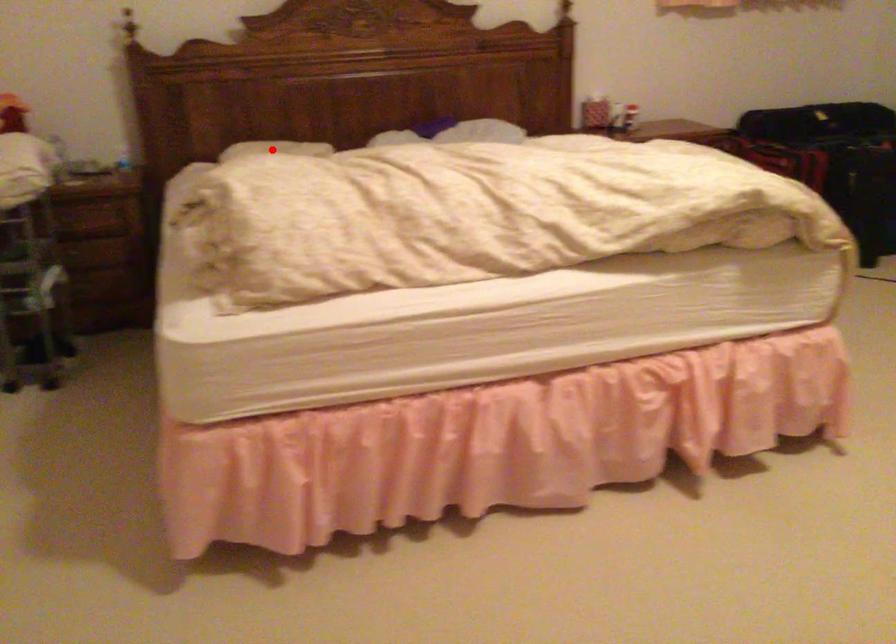
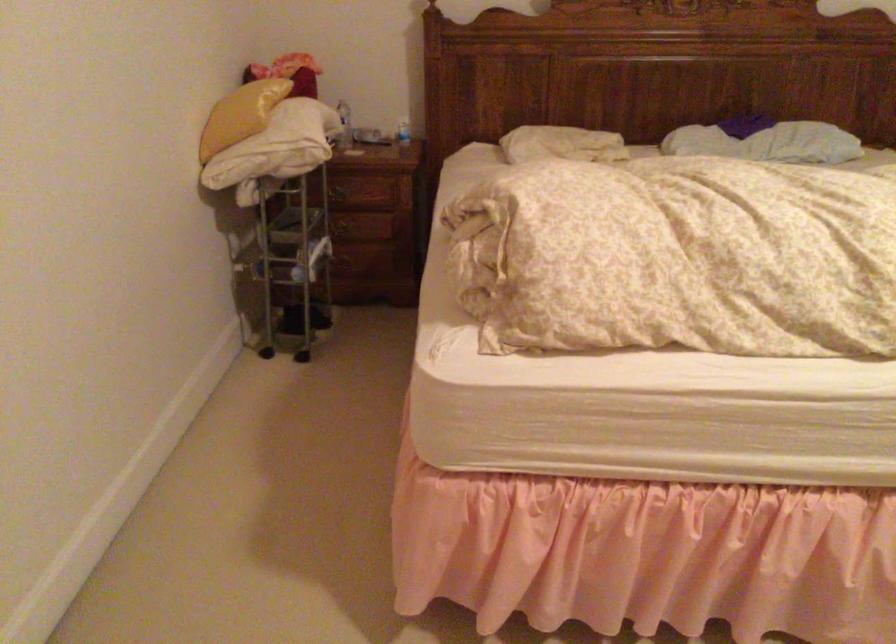
Question: I am providing you with two images of the same scene from different viewpoints. Image1 has a red point marked. In image2, the corresponding 3D location appears at what relative position? Reply with the corresponding letter.

Choices:
 (A) Closer
 (B) Farther

Answer: (A)